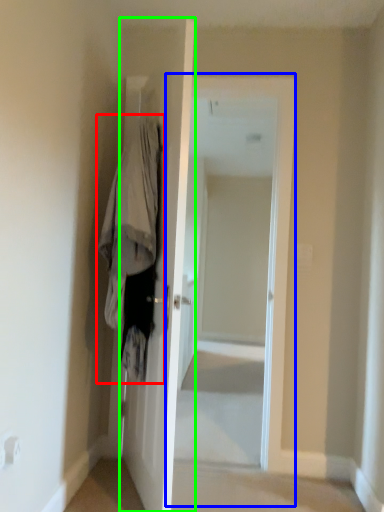
Question: Estimate the real-world distances between objects in this image. Which object is farther from clothing (highlighted by a red box), screen door (highlighted by a blue box) or door (highlighted by a green box)?

Choices:
 (A) screen door
 (B) door

Answer: (A)